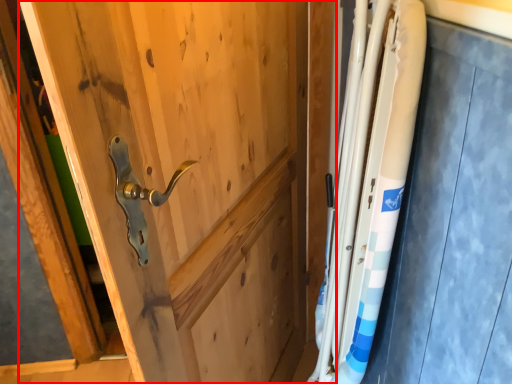
Question: From the image's perspective, where is door (annotated by the red box) located relative to steel?

Choices:
 (A) above
 (B) below

Answer: (B)